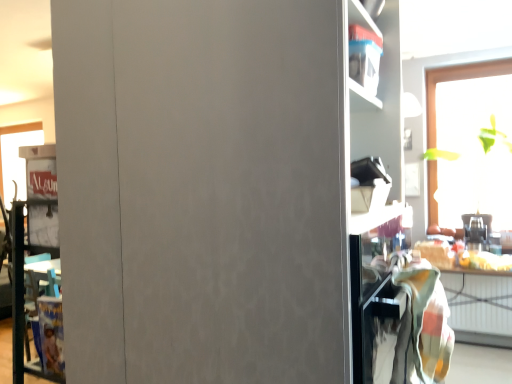
Question: Does transparent glass window at upper right have a greater width compared to multicolored woven blanket at right?

Choices:
 (A) yes
 (B) no

Answer: (B)

Question: Is transparent glass window at upper right aimed at multicolored woven blanket at right?

Choices:
 (A) no
 (B) yes

Answer: (B)

Question: Is transparent glass window at upper right outside of multicolored woven blanket at right?

Choices:
 (A) no
 (B) yes

Answer: (B)

Question: From the image's perspective, is transparent glass window at upper right above multicolored woven blanket at right?

Choices:
 (A) no
 (B) yes

Answer: (B)

Question: Is the position of transparent glass window at upper right less distant than that of multicolored woven blanket at right?

Choices:
 (A) no
 (B) yes

Answer: (A)

Question: From the image's perspective, relative to wooden table at lower right, is metallic silver toaster at right above or below?

Choices:
 (A) below
 (B) above

Answer: (B)

Question: Considering the positions of metallic silver toaster at right and wooden table at lower right in the image, is metallic silver toaster at right bigger or smaller than wooden table at lower right?

Choices:
 (A) big
 (B) small

Answer: (B)

Question: In the image, is metallic silver toaster at right on the left side or the right side of wooden table at lower right?

Choices:
 (A) right
 (B) left

Answer: (A)

Question: Considering the positions of point (482, 228) and point (442, 284), is point (482, 228) closer or farther from the camera than point (442, 284)?

Choices:
 (A) farther
 (B) closer

Answer: (A)

Question: Considering the positions of wooden table at lower right and multicolored woven blanket at right in the image, is wooden table at lower right bigger or smaller than multicolored woven blanket at right?

Choices:
 (A) big
 (B) small

Answer: (A)

Question: From the image's perspective, is wooden table at lower right above or below multicolored woven blanket at right?

Choices:
 (A) above
 (B) below

Answer: (B)

Question: Considering the positions of point (486, 273) and point (431, 317), is point (486, 273) closer or farther from the camera than point (431, 317)?

Choices:
 (A) closer
 (B) farther

Answer: (B)

Question: From their relative heights in the image, would you say wooden table at lower right is taller or shorter than multicolored woven blanket at right?

Choices:
 (A) tall
 (B) short

Answer: (A)

Question: Considering the positions of metallic silver toaster at right and multicolored woven blanket at right in the image, is metallic silver toaster at right taller or shorter than multicolored woven blanket at right?

Choices:
 (A) short
 (B) tall

Answer: (B)

Question: In terms of size, does metallic silver toaster at right appear bigger or smaller than multicolored woven blanket at right?

Choices:
 (A) big
 (B) small

Answer: (A)